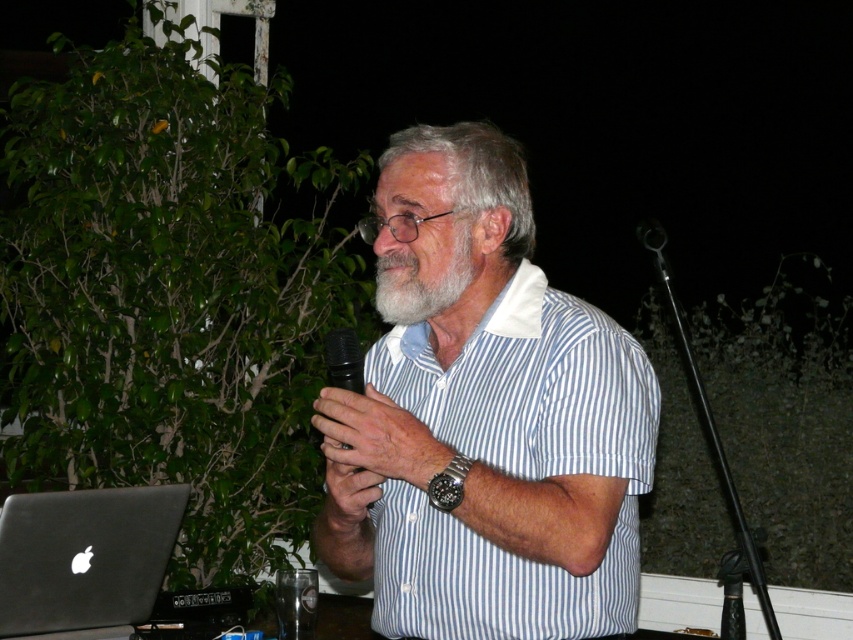
Describe the element at coordinates (483, 417) in the screenshot. The width and height of the screenshot is (853, 640). I see `white striped shirt at center` at that location.

Does white striped shirt at center appear on the left side of matte black microphone at center?

No, white striped shirt at center is not to the left of matte black microphone at center.

The height and width of the screenshot is (640, 853). I want to click on white striped shirt at center, so click(x=483, y=417).

Who is higher up, white striped shirt at center or grayhairbeard at center?

Positioned higher is grayhairbeard at center.

Can you confirm if white striped shirt at center is positioned below grayhairbeard at center?

Correct, white striped shirt at center is located below grayhairbeard at center.

This screenshot has width=853, height=640. What do you see at coordinates (483, 417) in the screenshot?
I see `white striped shirt at center` at bounding box center [483, 417].

Find the location of `white striped shirt at center`. white striped shirt at center is located at coordinates (483, 417).

Does matte black microphone at center appear on the right side of grayhairbeard at center?

No, matte black microphone at center is not to the right of grayhairbeard at center.

Can you confirm if matte black microphone at center is shorter than grayhairbeard at center?

Yes, matte black microphone at center is shorter than grayhairbeard at center.

Who is more distant from viewer, (405, 428) or (381, 282)?

Point (381, 282)

The height and width of the screenshot is (640, 853). In order to click on matte black microphone at center in this screenshot , I will do `click(376, 436)`.